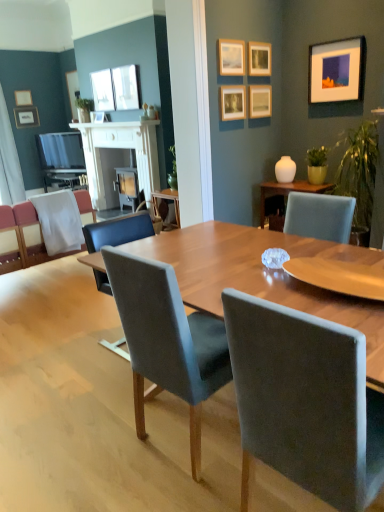
Identify the location of vacant area situated below fabric upholstered chair at center, arranged as the 2th chair when viewed from the right (from a real-world perspective). pyautogui.click(x=203, y=440).